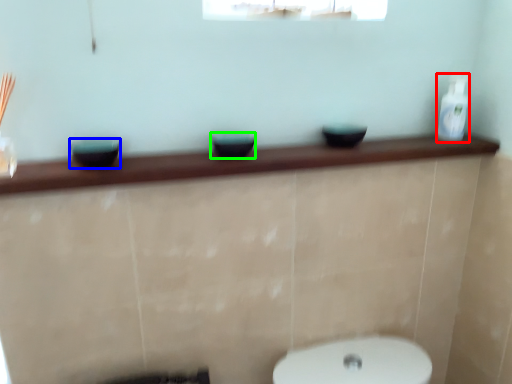
Question: Which is farther away from toiletry (highlighted by a red box)? basin (highlighted by a blue box) or basin (highlighted by a green box)?

Choices:
 (A) basin
 (B) basin

Answer: (A)